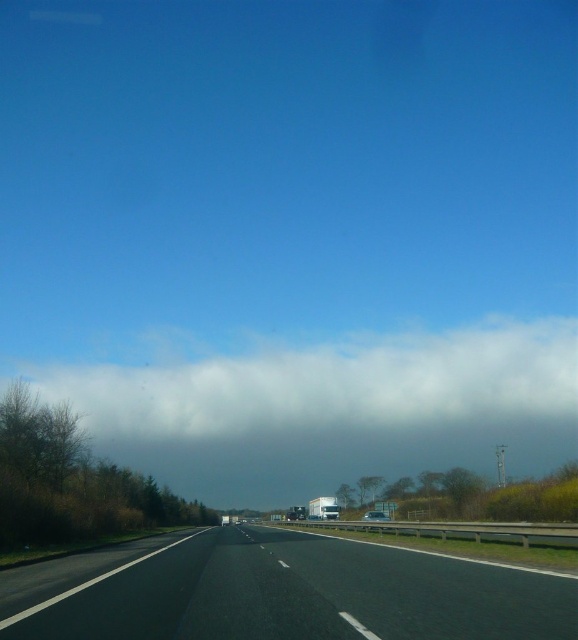
You are a driver approaching the highway. You see the point marked at coordinates (292, 593). What is this point located on?

The point at coordinates (292, 593) is located on the black asphalt highway at center.

You are driving on the highway and see the black asphalt highway at center and the white fluffy cloud at upper center. Which object is closer to you?

The black asphalt highway at center is closer to you because it is in front of the white fluffy cloud at upper center.

You are a driver approaching the black asphalt highway at center. You notice a white fluffy cloud at upper center in the sky. Which object appears wider from your perspective?

The white fluffy cloud at upper center appears wider than the black asphalt highway at center because the highway has a lesser width compared to the cloud.